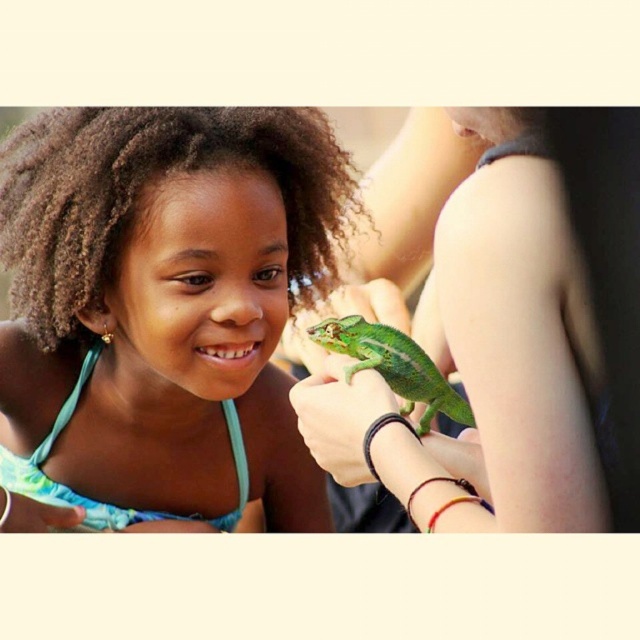
Is matte green chameleon at center wider than green scaly lizard at center?

Correct, the width of matte green chameleon at center exceeds that of green scaly lizard at center.

Can you confirm if matte green chameleon at center is taller than green scaly lizard at center?

Correct, matte green chameleon at center is much taller as green scaly lizard at center.

Who is more forward, (262, 253) or (444, 403)?

Positioned in front is point (444, 403).

I want to click on matte green chameleon at center, so click(x=166, y=298).

Does matte green chameleon at center lie in front of green matte chameleon at center?

No.

Is matte green chameleon at center to the left of green matte chameleon at center from the viewer's perspective?

Indeed, matte green chameleon at center is positioned on the left side of green matte chameleon at center.

Is point (168, 396) positioned after point (328, 360)?

That is True.

Where is `matte green chameleon at center`? The height and width of the screenshot is (640, 640). matte green chameleon at center is located at coordinates (166, 298).

From the picture: Does green matte chameleon at center appear under green scaly lizard at center?

Yes, green matte chameleon at center is below green scaly lizard at center.

The width and height of the screenshot is (640, 640). What do you see at coordinates (349, 426) in the screenshot? I see `green matte chameleon at center` at bounding box center [349, 426].

Locate an element on the screen. green matte chameleon at center is located at coordinates (349, 426).